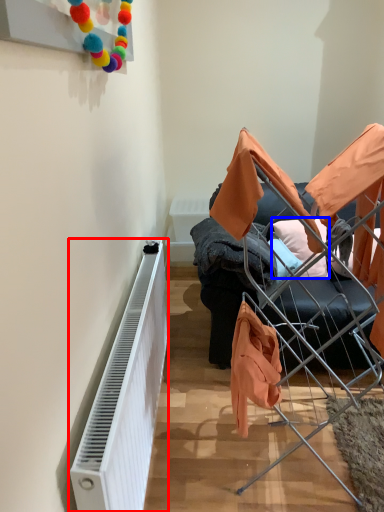
Question: Which point is closer to the camera, radiator (highlighted by a red box) or pillow (highlighted by a blue box)?

Choices:
 (A) radiator
 (B) pillow

Answer: (A)